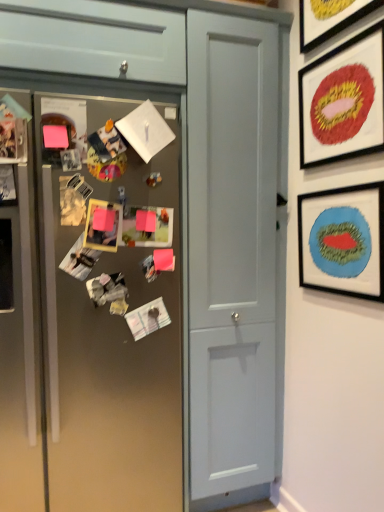
Question: Is metallic gray fridge at left shorter than metallic silver photo frame at left, the 2th art from the back?

Choices:
 (A) no
 (B) yes

Answer: (A)

Question: Does metallic gray fridge at left have a larger size compared to metallic silver photo frame at left, which is the 1th art from left to right?

Choices:
 (A) yes
 (B) no

Answer: (A)

Question: Considering the relative sizes of metallic gray fridge at left and metallic silver photo frame at left, arranged as the first art when viewed from the front, in the image provided, is metallic gray fridge at left thinner than metallic silver photo frame at left, arranged as the first art when viewed from the front,?

Choices:
 (A) no
 (B) yes

Answer: (A)

Question: Could metallic silver photo frame at left, arranged as the first art when viewed from the front, be considered to be inside metallic gray fridge at left?

Choices:
 (A) no
 (B) yes

Answer: (B)

Question: From a real-world perspective, is metallic gray fridge at left over metallic silver photo frame at left, acting as the second art starting from the right?

Choices:
 (A) no
 (B) yes

Answer: (B)

Question: Is metallic silver photo frame at left, arranged as the first art when viewed from the front, taller or shorter than brushed metal cabinet at upper left?

Choices:
 (A) short
 (B) tall

Answer: (A)

Question: Relative to brushed metal cabinet at upper left, is metallic silver photo frame at left, which is the 1th art from left to right, in front or behind?

Choices:
 (A) front
 (B) behind

Answer: (B)

Question: From the image's perspective, relative to brushed metal cabinet at upper left, is metallic silver photo frame at left, arranged as the first art when viewed from the front, above or below?

Choices:
 (A) below
 (B) above

Answer: (A)

Question: From a real-world perspective, relative to brushed metal cabinet at upper left, is metallic silver photo frame at left, acting as the second art starting from the right, vertically above or below?

Choices:
 (A) above
 (B) below

Answer: (B)

Question: From a real-world perspective, is metallic silver photo frame at center, the second art viewed from the front, physically located above or below yellow matte picture frame at upper right, arranged as the 3th picture frame when ordered from the bottom?

Choices:
 (A) above
 (B) below

Answer: (B)

Question: In terms of size, does metallic silver photo frame at center, placed as the 1th art when sorted from back to front, appear bigger or smaller than yellow matte picture frame at upper right, arranged as the 3th picture frame when ordered from the bottom?

Choices:
 (A) small
 (B) big

Answer: (A)

Question: In the image, is metallic silver photo frame at center, placed as the 1th art when sorted from back to front, on the left side or the right side of yellow matte picture frame at upper right, which appears as the 1th picture frame when viewed from the top?

Choices:
 (A) right
 (B) left

Answer: (B)

Question: In terms of width, does metallic silver photo frame at center, the second art viewed from the front, look wider or thinner when compared to yellow matte picture frame at upper right, which appears as the 1th picture frame when viewed from the top?

Choices:
 (A) thin
 (B) wide

Answer: (A)

Question: Does point (362, 110) appear closer or farther from the camera than point (89, 49)?

Choices:
 (A) farther
 (B) closer

Answer: (B)

Question: From their relative heights in the image, would you say matte red lips at upper right, acting as the second picture frame starting from the top, is taller or shorter than brushed metal cabinet at upper left?

Choices:
 (A) tall
 (B) short

Answer: (B)